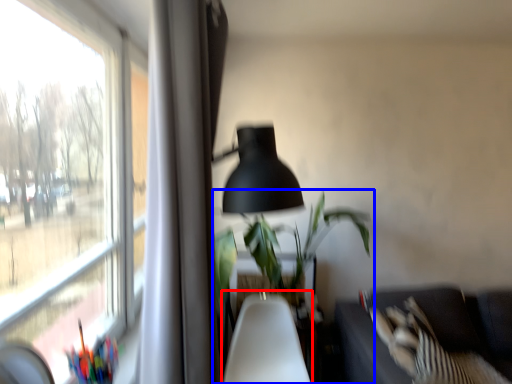
Question: Among these objects, which one is nearest to the camera, swivel chair (highlighted by a red box) or houseplant (highlighted by a blue box)?

Choices:
 (A) swivel chair
 (B) houseplant

Answer: (A)